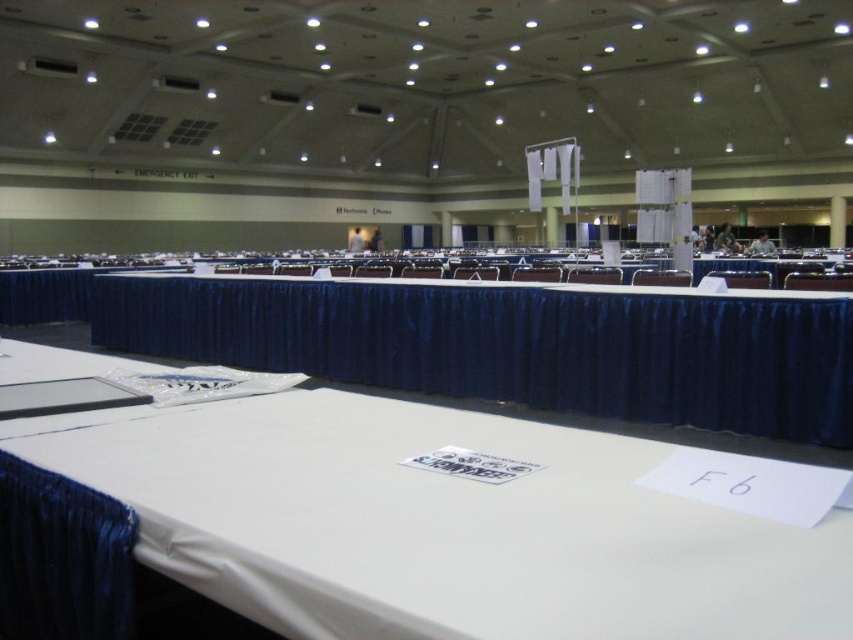
Question: Is white fabric tablecloth at center above matte black chair at right?

Choices:
 (A) no
 (B) yes

Answer: (A)

Question: Which point appears closest to the camera in this image?

Choices:
 (A) (845, 604)
 (B) (805, 276)
 (C) (688, 278)

Answer: (A)

Question: Which of the following is the closest to the observer?

Choices:
 (A) white paper at center
 (B) white plastic chair at center
 (C) matte black chair at center
 (D) white fabric tablecloth at center

Answer: (A)

Question: Where is white paper at center located in relation to matte black chair at center in the image?

Choices:
 (A) below
 (B) above

Answer: (A)

Question: Among these objects, which one is farthest from the camera?

Choices:
 (A) white fabric tablecloth at center
 (B) matte black chair at right

Answer: (B)

Question: Observing the image, what is the correct spatial positioning of matte black chair at right in reference to matte black chair at center?

Choices:
 (A) above
 (B) below

Answer: (B)